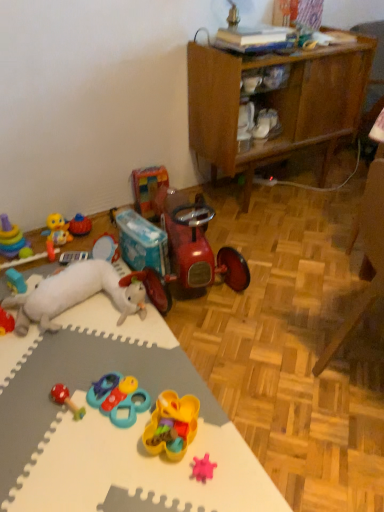
The image size is (384, 512). In order to click on unoccupied region to the right of teal plastic toy at center, the eighth toy viewed from the left in this screenshot , I will do `click(182, 383)`.